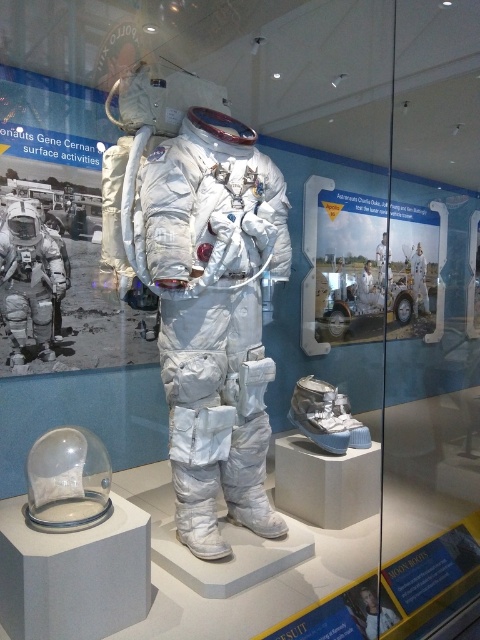
Between point (227, 122) and point (410, 256), which one is positioned in front?

Point (227, 122)

What do you see at coordinates (215, 316) in the screenshot? The height and width of the screenshot is (640, 480). I see `white metallic spacesuit at center` at bounding box center [215, 316].

Between point (225, 193) and point (417, 280), which one is positioned behind?

The point (417, 280) is more distant.

Locate an element on the screen. white metallic spacesuit at center is located at coordinates (215, 316).

Is white metallic spacesuit at center below matte white spacesuit at center?

Yes, white metallic spacesuit at center is below matte white spacesuit at center.

Which is behind, point (279, 188) or point (11, 304)?

Point (11, 304)

Locate an element on the screen. The image size is (480, 640). white metallic spacesuit at center is located at coordinates (215, 316).

Measure the distance between matte white spacesuit at center and white matte spacesuit at center.

3.74 meters

Can you confirm if matte white spacesuit at center is smaller than white matte spacesuit at center?

No, matte white spacesuit at center is not smaller than white matte spacesuit at center.

Where is `matte white spacesuit at center`? This screenshot has width=480, height=640. matte white spacesuit at center is located at coordinates (28, 280).